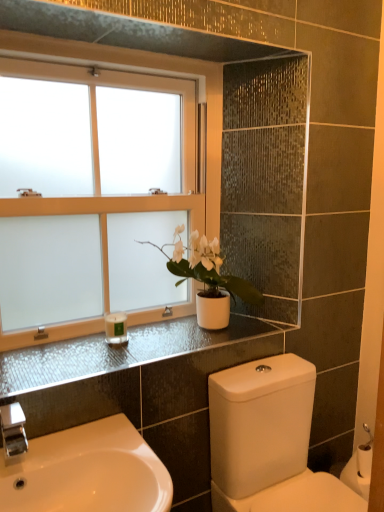
Question: Would you say white glossy sink at lower left contains white matte pot at center?

Choices:
 (A) yes
 (B) no

Answer: (B)

Question: From a real-world perspective, is white glossy sink at lower left physically above white matte pot at center?

Choices:
 (A) no
 (B) yes

Answer: (A)

Question: From the image's perspective, would you say white glossy sink at lower left is positioned over white matte pot at center?

Choices:
 (A) no
 (B) yes

Answer: (A)

Question: Considering the relative positions of white glossy sink at lower left and white matte pot at center in the image provided, is white glossy sink at lower left in front of white matte pot at center?

Choices:
 (A) no
 (B) yes

Answer: (B)

Question: Considering the relative sizes of white glossy sink at lower left and white matte pot at center in the image provided, is white glossy sink at lower left shorter than white matte pot at center?

Choices:
 (A) yes
 (B) no

Answer: (A)

Question: Visually, is white matte pot at center positioned to the left or to the right of white glossy sink at lower left?

Choices:
 (A) right
 (B) left

Answer: (A)

Question: Is point (220, 263) positioned closer to the camera than point (61, 446)?

Choices:
 (A) closer
 (B) farther

Answer: (B)

Question: Is white matte pot at center in front of or behind white glossy sink at lower left in the image?

Choices:
 (A) behind
 (B) front

Answer: (A)

Question: Choose the correct answer: Is white matte pot at center inside white glossy sink at lower left or outside it?

Choices:
 (A) inside
 (B) outside

Answer: (B)

Question: From a real-world perspective, relative to white frosted glass window at upper left, is white glossy toilet at lower right vertically above or below?

Choices:
 (A) above
 (B) below

Answer: (B)

Question: In terms of size, does white glossy toilet at lower right appear bigger or smaller than white frosted glass window at upper left?

Choices:
 (A) big
 (B) small

Answer: (A)

Question: Considering the positions of point (216, 444) and point (135, 72), is point (216, 444) closer or farther from the camera than point (135, 72)?

Choices:
 (A) closer
 (B) farther

Answer: (A)

Question: From the image's perspective, is white glossy toilet at lower right above or below white frosted glass window at upper left?

Choices:
 (A) above
 (B) below

Answer: (B)

Question: Is satin black countertop at upper center wider or thinner than white glossy toilet at lower right?

Choices:
 (A) thin
 (B) wide

Answer: (A)

Question: Looking at the image, does satin black countertop at upper center seem bigger or smaller compared to white glossy toilet at lower right?

Choices:
 (A) small
 (B) big

Answer: (A)